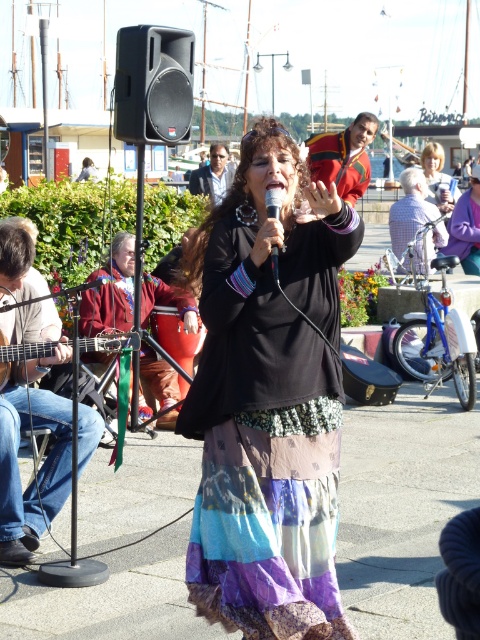
You are a photographer at the event and want to capture a photo of the denim jeans at left and the black plastic speaker at upper left. Which object should you focus on first to ensure both are in the frame?

You should focus on the denim jeans at left first since it is in front of the black plastic speaker at upper left, so positioning the camera to include both would require ensuring the foreground object is properly framed.

You are a sound technician who needs to adjust the volume of the black plastic speaker at upper left. You are currently standing next to the denim jeans at left. Can you reach the speaker without moving more than 3 meters?

The distance between denim jeans at left and black plastic speaker at upper left is 3.61 meters. Since 3.61 meters is greater than 3 meters, you cannot reach the speaker without moving more than 3 meters.